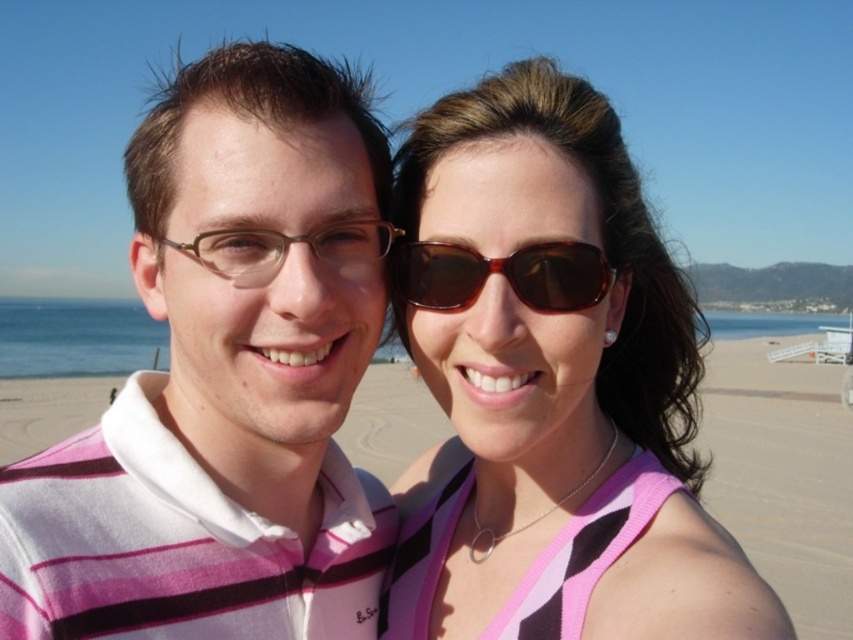
Which is above, matte brown sunglasses at upper right or brown matte glasses at center?

Positioned higher is brown matte glasses at center.

Does matte brown sunglasses at upper right lie in front of brown matte glasses at center?

Yes, it is in front of brown matte glasses at center.

You are a GUI agent. You are given a task and a screenshot of the screen. Output one action in this format:
    pyautogui.click(x=<x>, y=<y>)
    Task: Click on the matte brown sunglasses at upper right
    Image resolution: width=853 pixels, height=640 pixels.
    Given the screenshot: What is the action you would take?
    coord(554,385)

Is point (529, 481) less distant than point (824, 609)?

Yes, point (529, 481) is in front of point (824, 609).

Can you confirm if matte brown sunglasses at upper right is wider than beige sand at center?

Incorrect, matte brown sunglasses at upper right's width does not surpass beige sand at center's.

What do you see at coordinates (554, 385) in the screenshot? This screenshot has width=853, height=640. I see `matte brown sunglasses at upper right` at bounding box center [554, 385].

I want to click on matte brown sunglasses at upper right, so click(554, 385).

Is beige sand at center positioned before brown matte glasses at center?

No.

Who is lower down, beige sand at center or brown matte glasses at center?

beige sand at center

Does point (779, 477) come in front of point (244, 262)?

No.

Locate an element on the screen. Image resolution: width=853 pixels, height=640 pixels. beige sand at center is located at coordinates (782, 476).